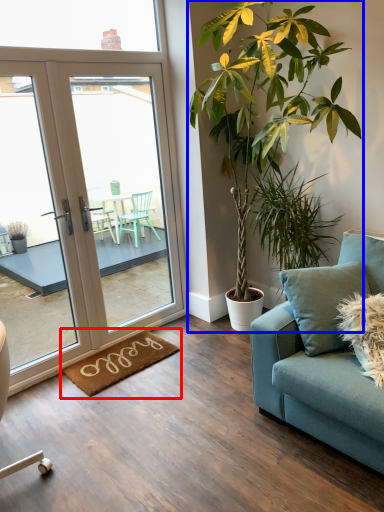
Question: Among these objects, which one is farthest to the camera, mat (highlighted by a red box) or houseplant (highlighted by a blue box)?

Choices:
 (A) mat
 (B) houseplant

Answer: (A)